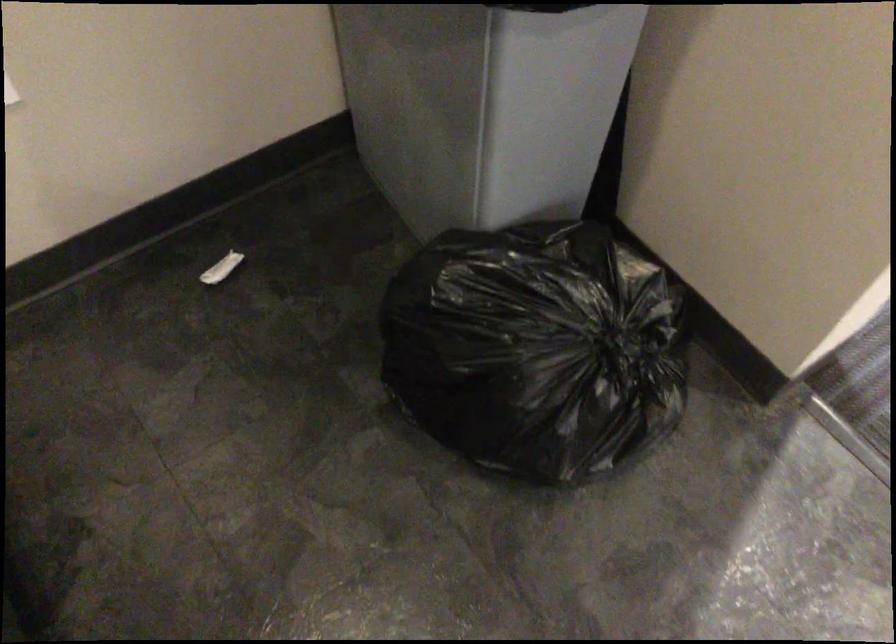
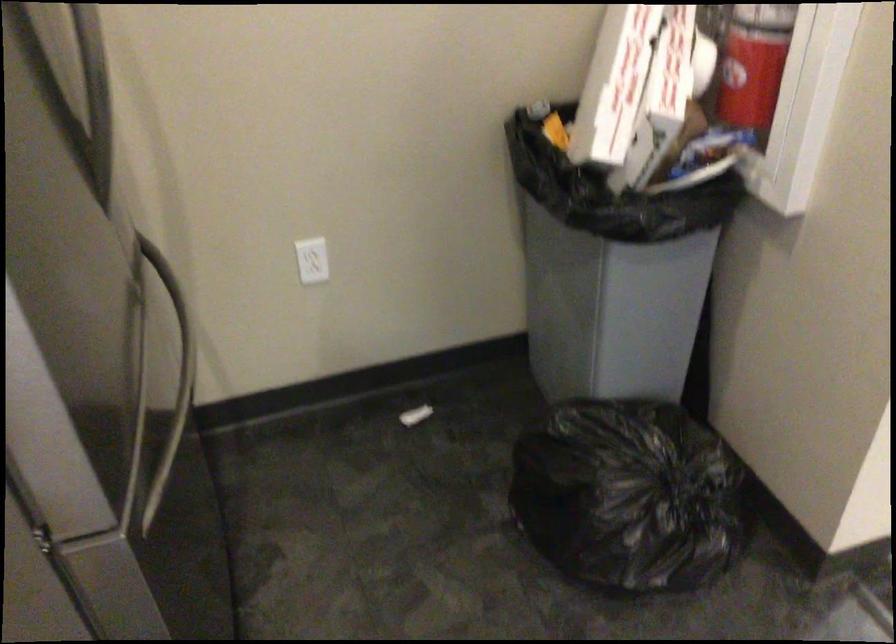
The point at [553,366] is marked in the first image. Where is the corresponding point in the second image?

(629, 496)